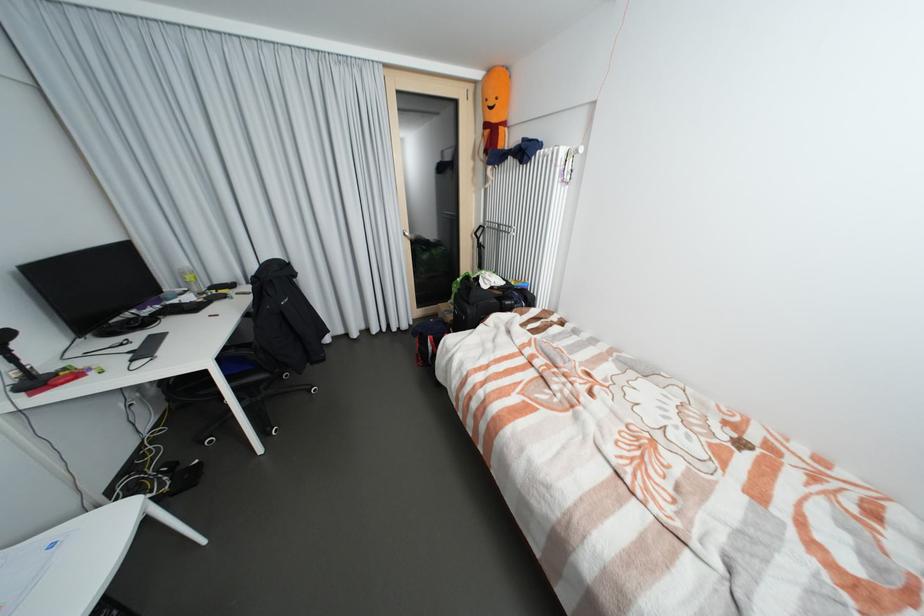
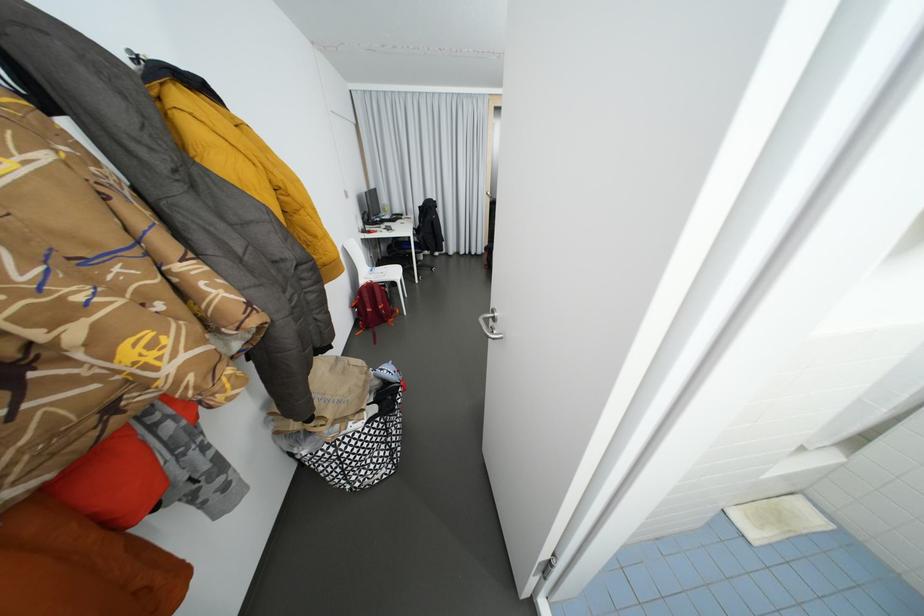
Question: I am providing you with two images of the same scene from different viewpoints. After the viewpoint changes to image2, which objects are now occluded?

Choices:
 (A) washing machine door handle
 (B) brown paper bag
 (C) red backpack
 (D) silver door handle

Answer: (D)